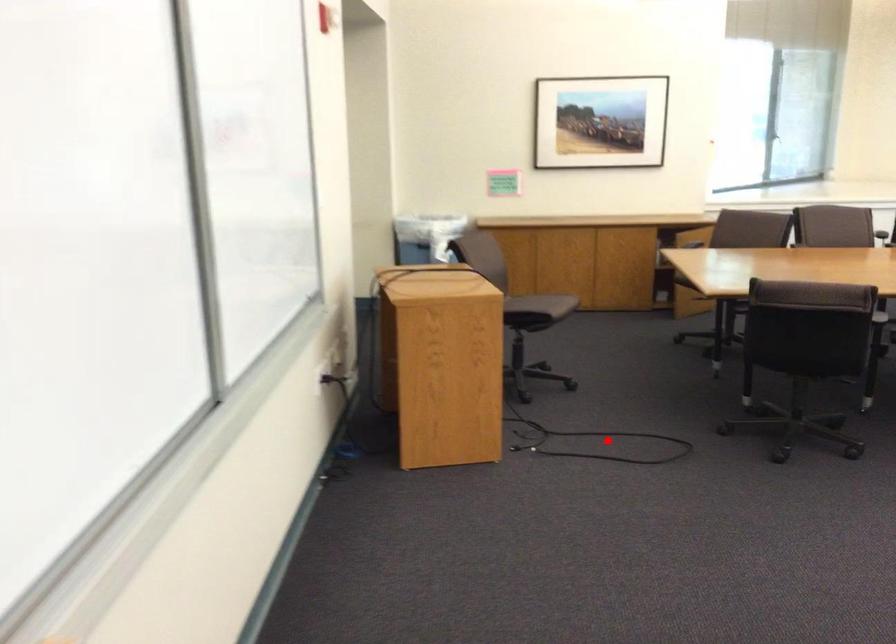
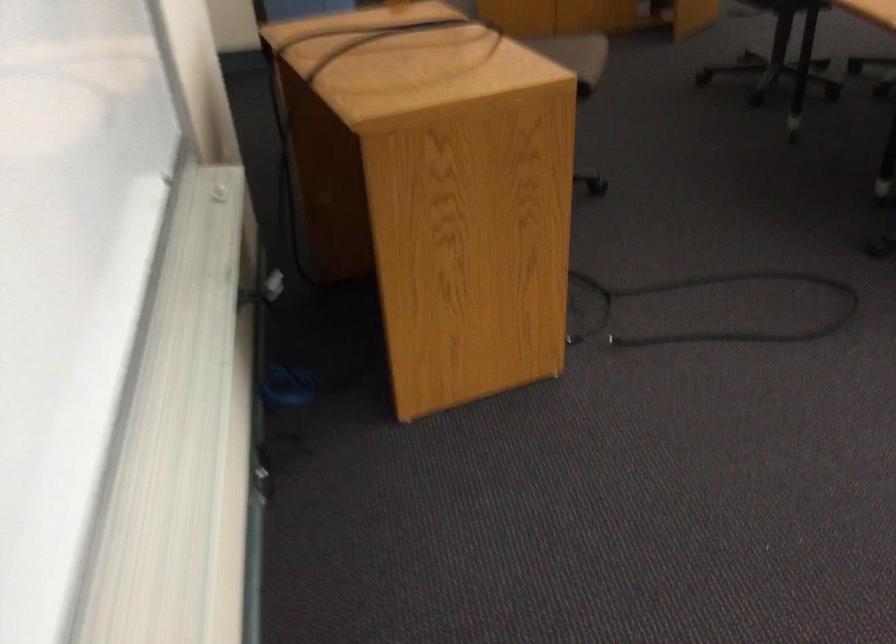
Where in the second image is the point corresponding to the highlighted location from the first image?

(712, 308)